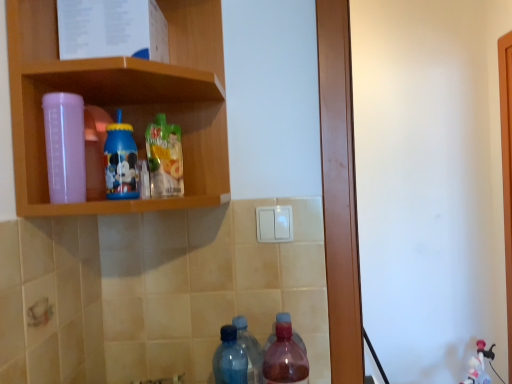
Question: Which direction should I rotate to look at blue plastic cup at upper center, which ranks as the 4th bottle in right-to-left order?

Choices:
 (A) left
 (B) right

Answer: (A)

Question: Which direction should I rotate to face translucent plastic juice at center, marked as the 3th bottle in a left-to-right arrangement, — up or down?

Choices:
 (A) down
 (B) up

Answer: (B)

Question: Is translucent pink bottle at lower center, acting as the 5th bottle starting from the left, not near translucent plastic juice at center, the 3th bottle viewed from the right?

Choices:
 (A) yes
 (B) no

Answer: (B)

Question: From a real-world perspective, is translucent pink bottle at lower center, the 1th bottle from the right, located beneath translucent plastic juice at center, the 3th bottle viewed from the right?

Choices:
 (A) yes
 (B) no

Answer: (A)

Question: Does translucent pink bottle at lower center, the 1th bottle from the right, have a lesser height compared to translucent plastic juice at center, the 3th bottle viewed from the right?

Choices:
 (A) no
 (B) yes

Answer: (A)

Question: Does translucent pink bottle at lower center, the 1th bottle from the right, have a lesser width compared to translucent plastic juice at center, marked as the 3th bottle in a left-to-right arrangement?

Choices:
 (A) no
 (B) yes

Answer: (A)

Question: From the image's perspective, does translucent pink bottle at lower center, acting as the 5th bottle starting from the left, appear higher than translucent plastic juice at center, the 3th bottle viewed from the right?

Choices:
 (A) no
 (B) yes

Answer: (A)

Question: Does translucent pink bottle at lower center, acting as the 5th bottle starting from the left, have a larger size compared to translucent plastic juice at center, marked as the 3th bottle in a left-to-right arrangement?

Choices:
 (A) yes
 (B) no

Answer: (A)

Question: Does pink plastic cup at upper left come in front of translucent plastic juice at center, marked as the 3th bottle in a left-to-right arrangement?

Choices:
 (A) no
 (B) yes

Answer: (B)

Question: From the image's perspective, would you say pink plastic cup at upper left is shown under translucent plastic juice at center, marked as the 3th bottle in a left-to-right arrangement?

Choices:
 (A) yes
 (B) no

Answer: (B)

Question: Is the position of pink plastic cup at upper left more distant than that of translucent plastic juice at center, the 3th bottle viewed from the right?

Choices:
 (A) yes
 (B) no

Answer: (B)

Question: From a real-world perspective, does pink plastic cup at upper left stand above translucent plastic juice at center, marked as the 3th bottle in a left-to-right arrangement?

Choices:
 (A) yes
 (B) no

Answer: (A)

Question: Does pink plastic cup at upper left have a lesser width compared to translucent plastic juice at center, the 3th bottle viewed from the right?

Choices:
 (A) yes
 (B) no

Answer: (B)

Question: Can you confirm if pink plastic cup at upper left is taller than translucent plastic juice at center, the 3th bottle viewed from the right?

Choices:
 (A) no
 (B) yes

Answer: (B)

Question: Is transparent plastic bottle at upper left, marked as the 1th bottle in a left-to-right arrangement, positioned before blue translucent bottle at lower center, acting as the second bottle starting from the right?

Choices:
 (A) yes
 (B) no

Answer: (A)